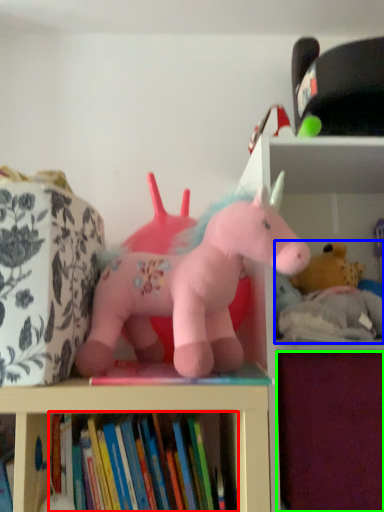
Question: Which is nearer to the book (highlighted by a red box)? toy (highlighted by a blue box) or drawer (highlighted by a green box).

Choices:
 (A) toy
 (B) drawer

Answer: (B)